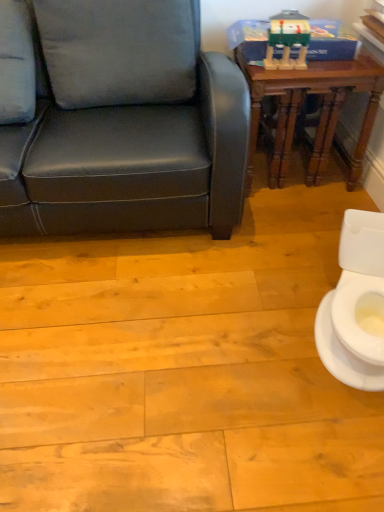
Where is `free space to the left of white glossy toilet at lower right`? Image resolution: width=384 pixels, height=512 pixels. free space to the left of white glossy toilet at lower right is located at coordinates (234, 329).